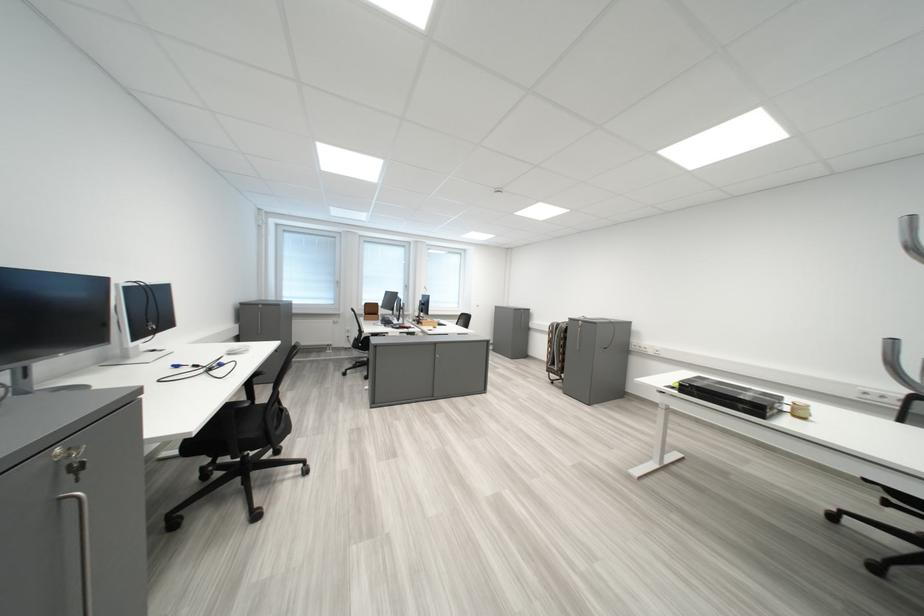
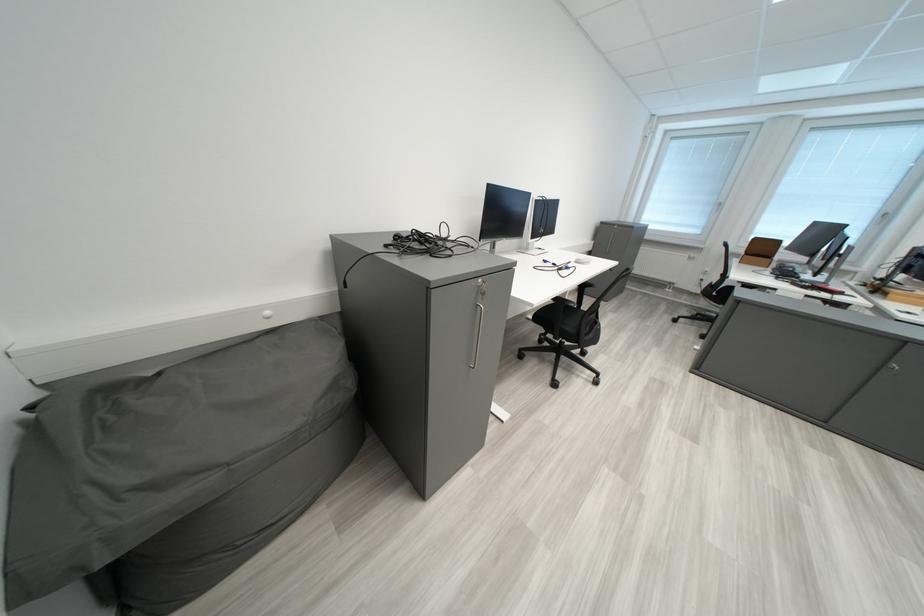
The point at [240,410] is marked in the first image. Where is the corresponding point in the second image?

(573, 302)